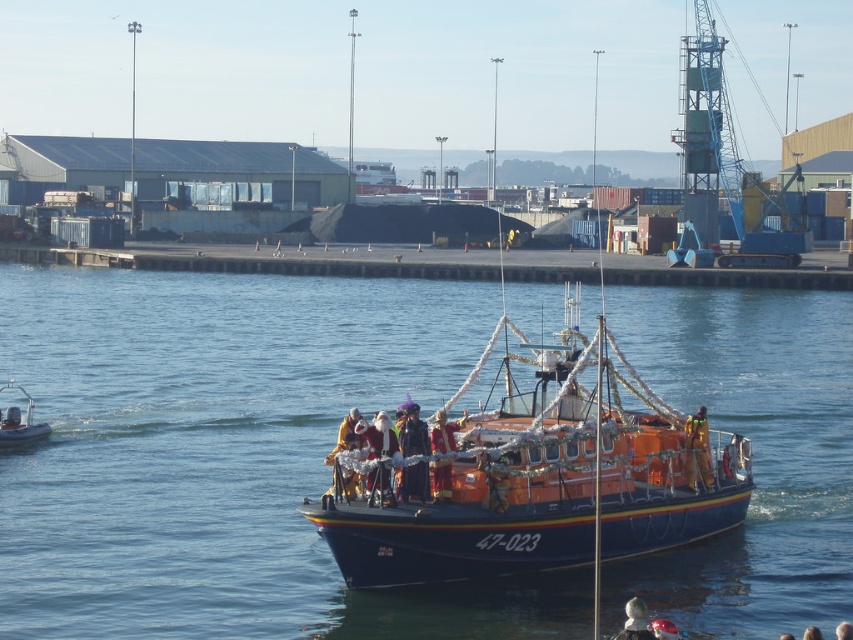
Is orange fiberglass motorboat at left bigger than orange fabric santa at center?

Yes, orange fiberglass motorboat at left is bigger than orange fabric santa at center.

Can you confirm if orange fiberglass motorboat at left is taller than orange fabric santa at center?

Indeed, orange fiberglass motorboat at left has a greater height compared to orange fabric santa at center.

Is point (26, 412) closer to camera compared to point (450, 428)?

No, it is not.

Where is `orange fiberglass motorboat at left`? Image resolution: width=853 pixels, height=640 pixels. orange fiberglass motorboat at left is located at coordinates (19, 422).

Between blue water at center and orange life vest at center, which one has less height?

orange life vest at center is shorter.

The width and height of the screenshot is (853, 640). What do you see at coordinates (224, 454) in the screenshot? I see `blue water at center` at bounding box center [224, 454].

Does point (357, 397) lie in front of point (701, 424)?

No, (357, 397) is behind (701, 424).

This screenshot has width=853, height=640. I want to click on blue water at center, so click(x=224, y=454).

Which of these two, shiny gold costume at center or orange life vest at center, stands shorter?

orange life vest at center is shorter.

Image resolution: width=853 pixels, height=640 pixels. Find the location of `shiny gold costume at center`. shiny gold costume at center is located at coordinates (398, 452).

Find the location of a particular element. This screenshot has height=640, width=853. shiny gold costume at center is located at coordinates coord(398,452).